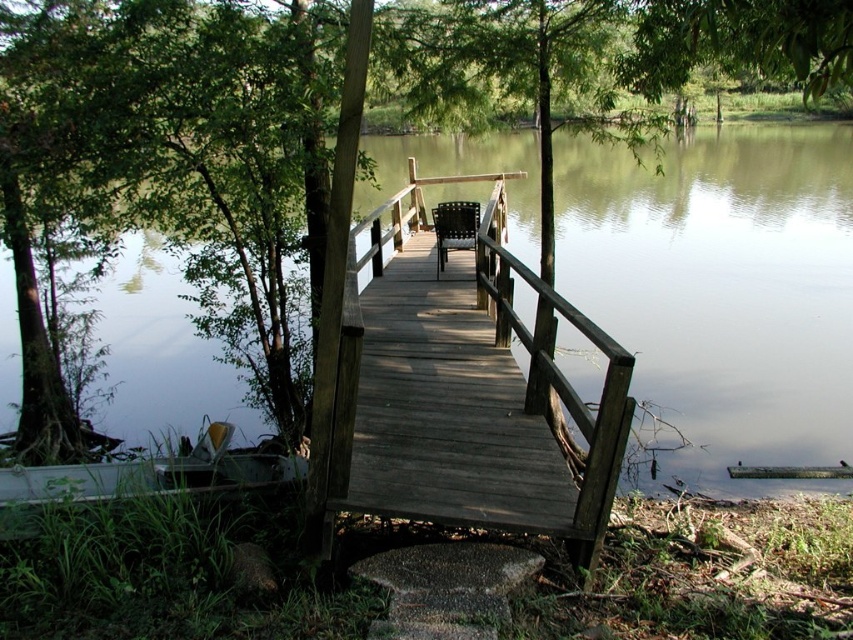
Question: Can you confirm if dark wood bridge at center is positioned to the left of brown woven chair at center?

Choices:
 (A) yes
 (B) no

Answer: (B)

Question: Can you confirm if dark wood bridge at center is positioned to the right of brown woven chair at center?

Choices:
 (A) no
 (B) yes

Answer: (B)

Question: Does dark wood bridge at center have a lesser width compared to brown woven chair at center?

Choices:
 (A) yes
 (B) no

Answer: (A)

Question: Among these objects, which one is farthest from the camera?

Choices:
 (A) dark wood bridge at center
 (B) brown woven chair at center

Answer: (B)

Question: Which point is farther from the camera taking this photo?

Choices:
 (A) (438, 237)
 (B) (395, 193)

Answer: (B)